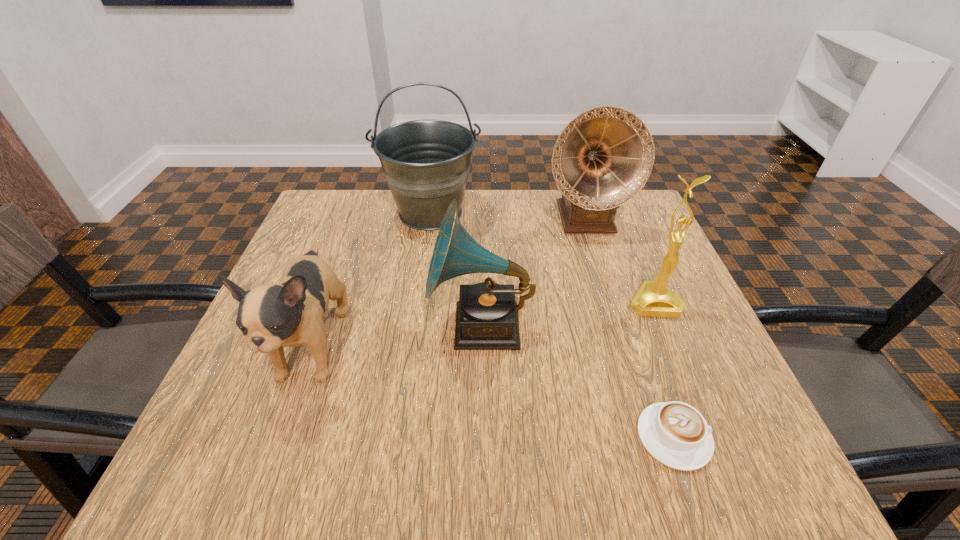
Find the location of a particular element. The width and height of the screenshot is (960, 540). object situated at the far right corner is located at coordinates (603, 157).

The height and width of the screenshot is (540, 960). I want to click on object that is at the near right corner, so click(676, 434).

Where is `vacant position at the far edge of the desktop`? The width and height of the screenshot is (960, 540). vacant position at the far edge of the desktop is located at coordinates (383, 208).

Identify the location of vacant space at the near edge of the desktop. This screenshot has height=540, width=960. (547, 480).

Where is `free space at the left edge of the desktop`? This screenshot has width=960, height=540. free space at the left edge of the desktop is located at coordinates (296, 252).

In the image, there is a desktop. Where is `free region at the right edge`? This screenshot has height=540, width=960. free region at the right edge is located at coordinates (646, 256).

The image size is (960, 540). I want to click on vacant region at the far left corner, so tap(326, 240).

Identify the location of vacant space at the far right corner of the desktop. (628, 211).

Where is `vacant area between the bucket and the award`? The height and width of the screenshot is (540, 960). vacant area between the bucket and the award is located at coordinates (542, 258).

This screenshot has width=960, height=540. I want to click on blank region between the right phonograph_record and the puppy, so click(449, 283).